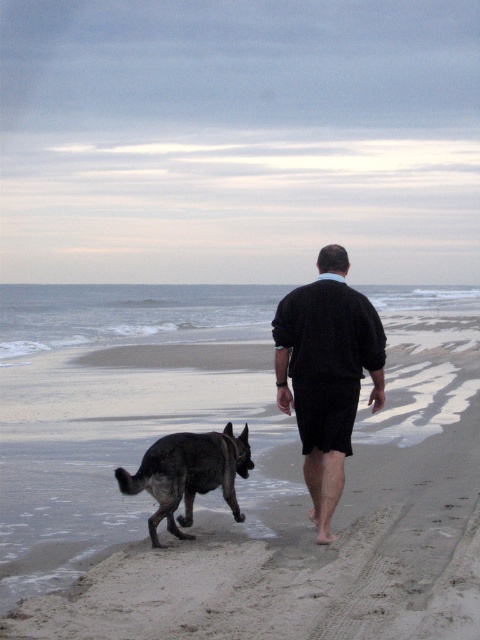
Which is above, sandy beach at center or dark brown fur dog at lower left?

sandy beach at center is above.

Can you confirm if sandy beach at center is positioned below dark brown fur dog at lower left?

No.

Find the location of `sandy beach at center`. sandy beach at center is located at coordinates (273, 532).

Is point (360, 627) positioned behind point (326, 262)?

That is False.

The height and width of the screenshot is (640, 480). Describe the element at coordinates (273, 532) in the screenshot. I see `sandy beach at center` at that location.

Is point (455, 472) behind point (286, 336)?

That is True.

Where is `sandy beach at center`? The height and width of the screenshot is (640, 480). sandy beach at center is located at coordinates (273, 532).

Who is shorter, dark blue sweater at center or dark brown fur dog at lower left?

With less height is dark brown fur dog at lower left.

Between point (349, 403) and point (214, 456), which one is positioned behind?

The point (214, 456) is behind.

This screenshot has width=480, height=640. In order to click on dark blue sweater at center in this screenshot , I will do `click(326, 372)`.